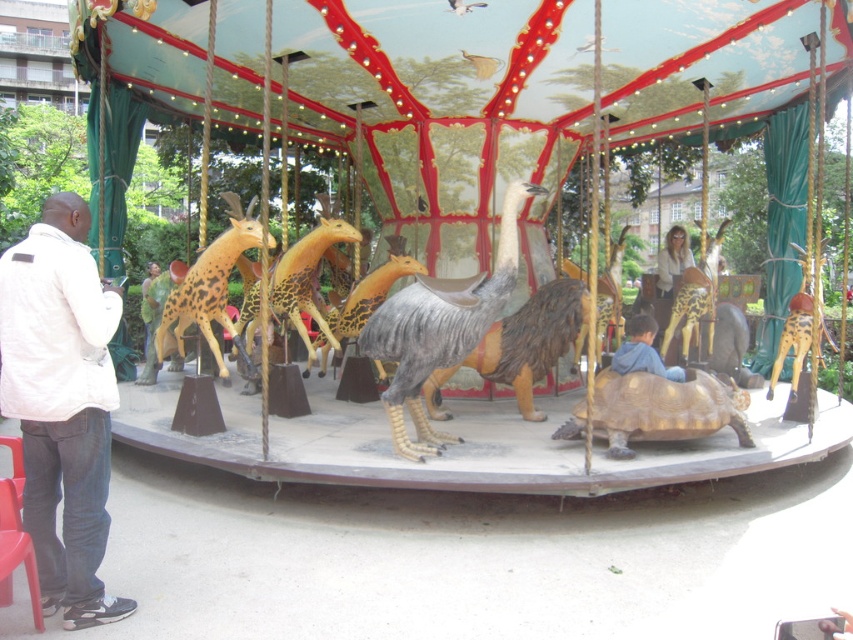
The width and height of the screenshot is (853, 640). What do you see at coordinates (62, 403) in the screenshot?
I see `white cotton jacket at lower left` at bounding box center [62, 403].

Can you confirm if white cotton jacket at lower left is bigger than matte gold sunglasses at center?

Correct, white cotton jacket at lower left is larger in size than matte gold sunglasses at center.

Is point (97, 580) more distant than point (675, 227)?

No.

Find the location of a particular element. The image size is (853, 640). white cotton jacket at lower left is located at coordinates (62, 403).

Who is positioned more to the left, brown textured ostrich at center or blue cotton shirt at lower center?

Positioned to the left is brown textured ostrich at center.

Describe the element at coordinates (439, 328) in the screenshot. The image size is (853, 640). I see `brown textured ostrich at center` at that location.

Image resolution: width=853 pixels, height=640 pixels. In order to click on brown textured ostrich at center in this screenshot , I will do `click(439, 328)`.

Between white cotton jacket at lower left and golden metallic tortoise at center, which one is positioned lower?

Positioned lower is golden metallic tortoise at center.

Measure the distance from white cotton jacket at lower left to golden metallic tortoise at center.

white cotton jacket at lower left is 3.15 meters away from golden metallic tortoise at center.

Between point (91, 262) and point (544, 355), which one is positioned behind?

The point (544, 355) is more distant.

Identify the location of white cotton jacket at lower left. (62, 403).